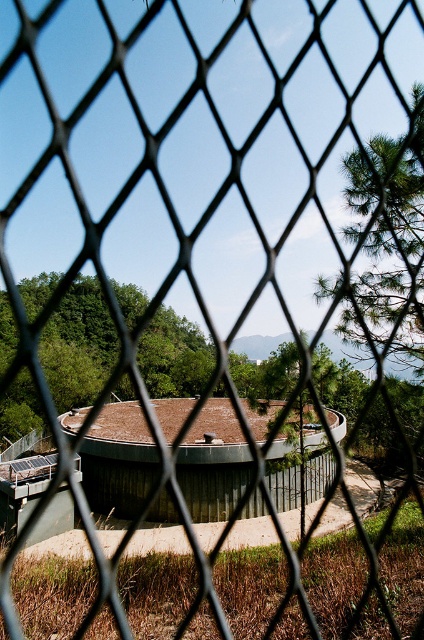
Is concrete wall at center below green textured pine tree at upper right?

Yes.

Does point (225, 404) lie behind point (390, 253)?

Yes, it is.

Find the location of a particular element. Image resolution: width=424 pixels, height=640 pixels. concrete wall at center is located at coordinates (119, 460).